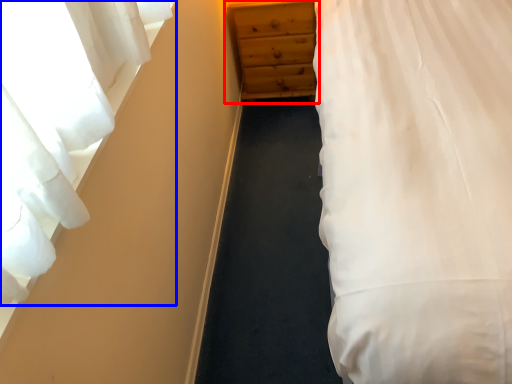
Question: Among these objects, which one is nearest to the camera, chest of drawers (highlighted by a red box) or curtain (highlighted by a blue box)?

Choices:
 (A) chest of drawers
 (B) curtain

Answer: (B)